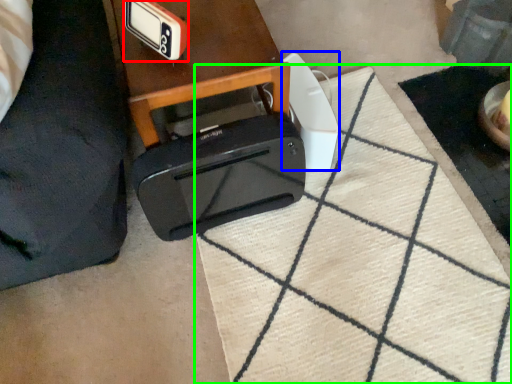
Question: Estimate the real-world distances between objects in this image. Which object is closer to gadget (highlighted by a red box), appliance (highlighted by a blue box) or doormat (highlighted by a green box)?

Choices:
 (A) appliance
 (B) doormat

Answer: (A)